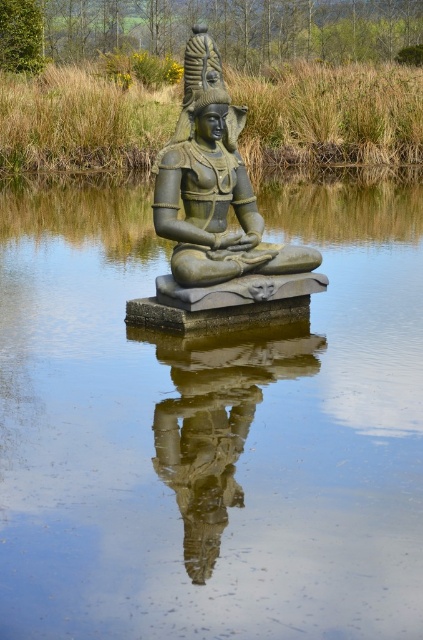
Between green stone statue at center and reflective stone statue at center, which one appears on the right side from the viewer's perspective?

Positioned to the right is reflective stone statue at center.

Identify the location of green stone statue at center. (214, 212).

Which is more to the left, transparent glass water at center or green stone statue at center?

green stone statue at center

Locate an element on the screen. transparent glass water at center is located at coordinates (209, 426).

Identify the location of transparent glass water at center. (209, 426).

Identify the location of transparent glass water at center. (209, 426).

What do you see at coordinates (209, 426) in the screenshot?
I see `transparent glass water at center` at bounding box center [209, 426].

The image size is (423, 640). In order to click on transparent glass water at center in this screenshot , I will do `click(209, 426)`.

Identify the location of transparent glass water at center. coord(209,426).

At what (x,y) coordinates should I click in order to perform the action: click on transparent glass water at center. Please return your answer as a coordinate pair (x, y). Image resolution: width=423 pixels, height=640 pixels. Looking at the image, I should click on (209, 426).